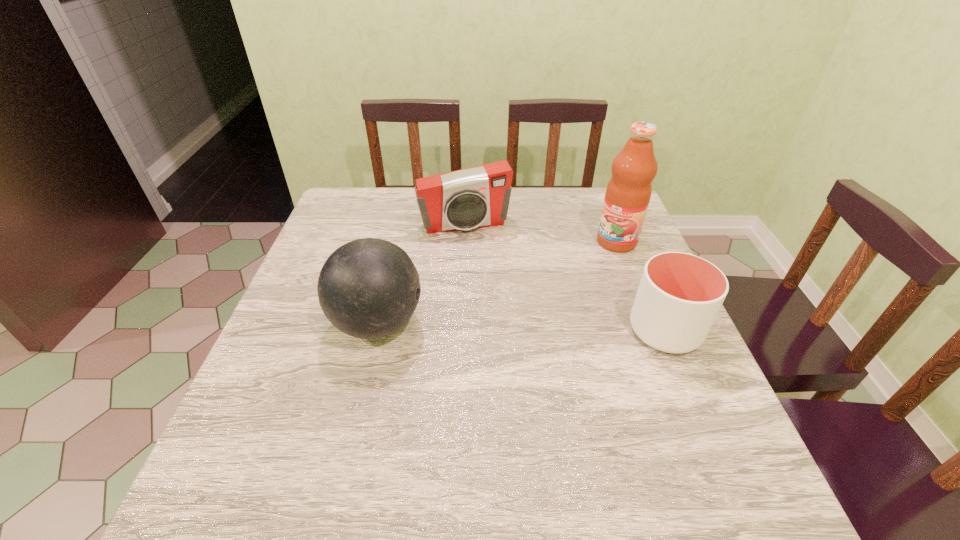
Where is `vacant space at the left edge of the desktop`? vacant space at the left edge of the desktop is located at coordinates (238, 405).

In order to click on blank area at the right edge in this screenshot , I will do `click(644, 358)`.

The image size is (960, 540). In the image, there is a desktop. Find the location of `vacant space at the near left corner`. vacant space at the near left corner is located at coordinates (241, 447).

Where is `vacant area at the far right corner`? vacant area at the far right corner is located at coordinates (595, 201).

You are a GUI agent. You are given a task and a screenshot of the screen. Output one action in this format:
    pyautogui.click(x=<x>, y=<y>)
    Task: Click on the vacant space that's between the camera and the second tallest object
    
    Given the screenshot: What is the action you would take?
    pyautogui.click(x=421, y=274)

Identify the location of free point between the second tallest object and the camera. click(x=421, y=274).

Image resolution: width=960 pixels, height=540 pixels. I want to click on vacant area that lies between the fruit juice and the camera, so click(540, 233).

This screenshot has height=540, width=960. Identify the location of free space between the second tallest object and the cup. (521, 327).

This screenshot has height=540, width=960. I want to click on free space between the fruit juice and the bowling ball, so click(x=497, y=282).

Locate an element on the screen. This screenshot has width=960, height=540. empty space that is in between the bowling ball and the cup is located at coordinates (521, 327).